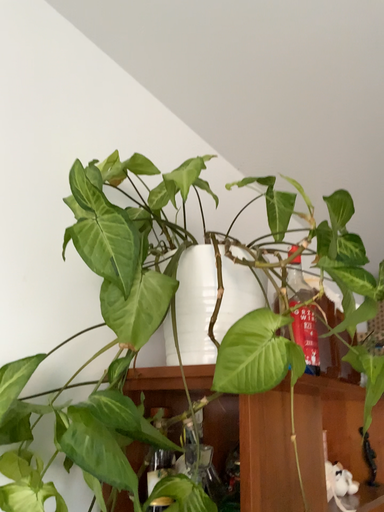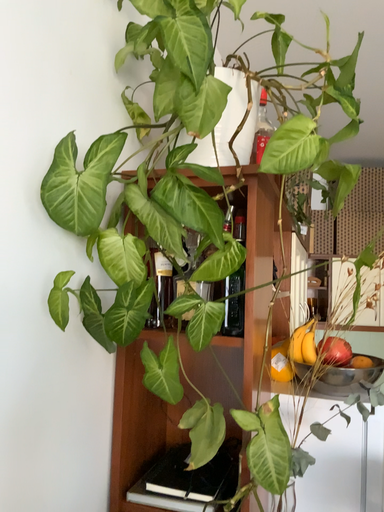
Question: Which way did the camera rotate in the video?

Choices:
 (A) rotated left
 (B) rotated right

Answer: (B)